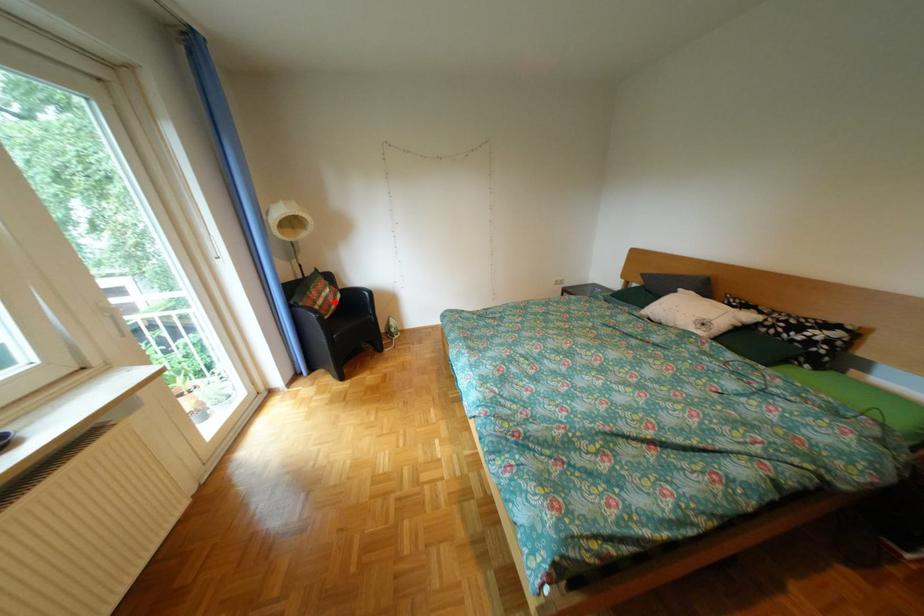
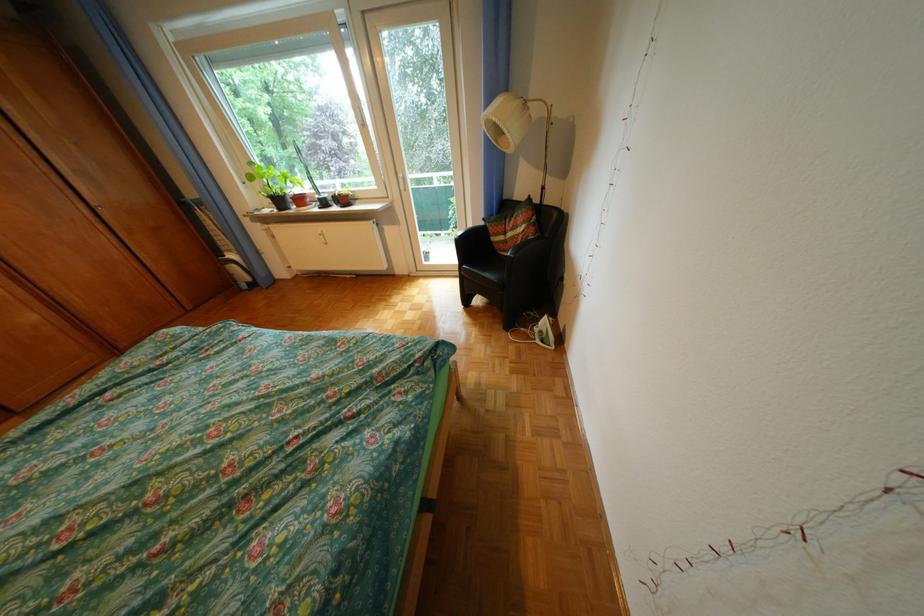
Question: A red point is marked in image1. In image2, is the corresponding 3D point closer to the camera or farther? Reply with the corresponding letter.

Choices:
 (A) The corresponding 3D point is closer.
 (B) The corresponding 3D point is farther.

Answer: (A)